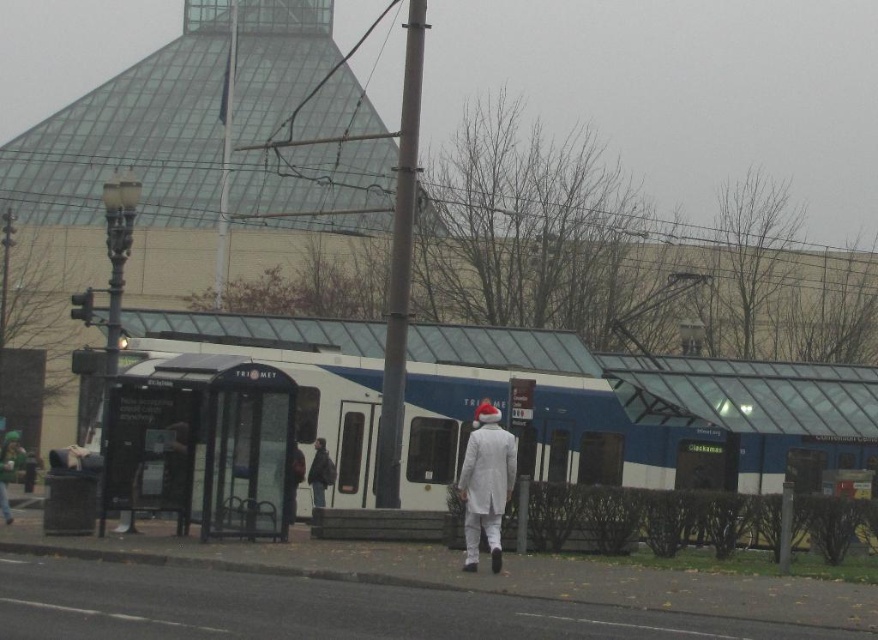
You are a pedestrian standing at the bus stop shelter. You want to take a photo of the white glossy train at center without the white matte coat at center appearing in the shot. Is this possible?

The white glossy train at center is above the white matte coat at center, so yes, you can take a photo of the white glossy train at center without the white matte coat at center by angling the camera upwards to exclude the coat.

You are standing at the bus stop shelter in the scene. Which direction should you look to see the white glossy train at center?

You should look towards the center of the scene to see the white glossy train at center.

You are standing at the bus stop shelter and want to walk to the tram. There are two points marked on the ground. One is at point (210, 522) and the other is at point (484, 412). Which point is closer to the tram?

Point (484, 412) is closer to the tram because it is in front of point (210, 522), which is behind it.